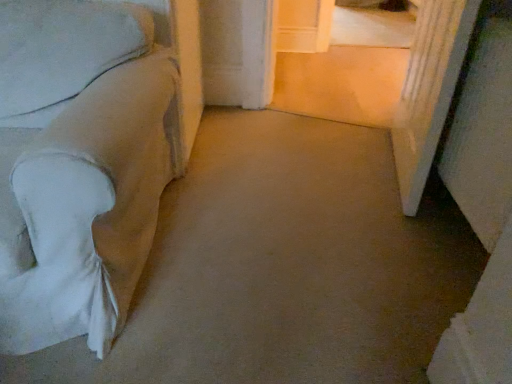
This screenshot has height=384, width=512. What do you see at coordinates (78, 167) in the screenshot? I see `white fabric couch at left` at bounding box center [78, 167].

Locate an element on the screen. white fabric couch at left is located at coordinates (78, 167).

In order to face white fabric couch at left, should I rotate leftwards or rightwards?

To align with it, rotate left about 29.389°.

Identify the location of white fabric couch at left. The image size is (512, 384). (78, 167).